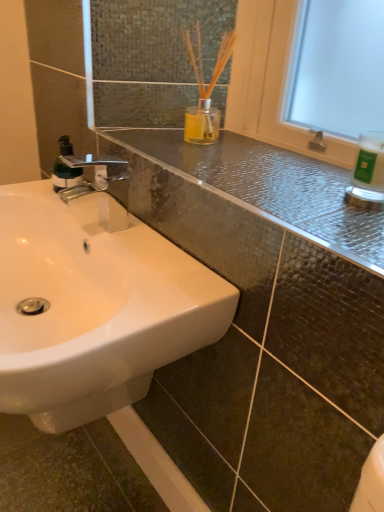
Image resolution: width=384 pixels, height=512 pixels. Identify the location of vacant space in front of green matte bottle at left. tap(79, 207).